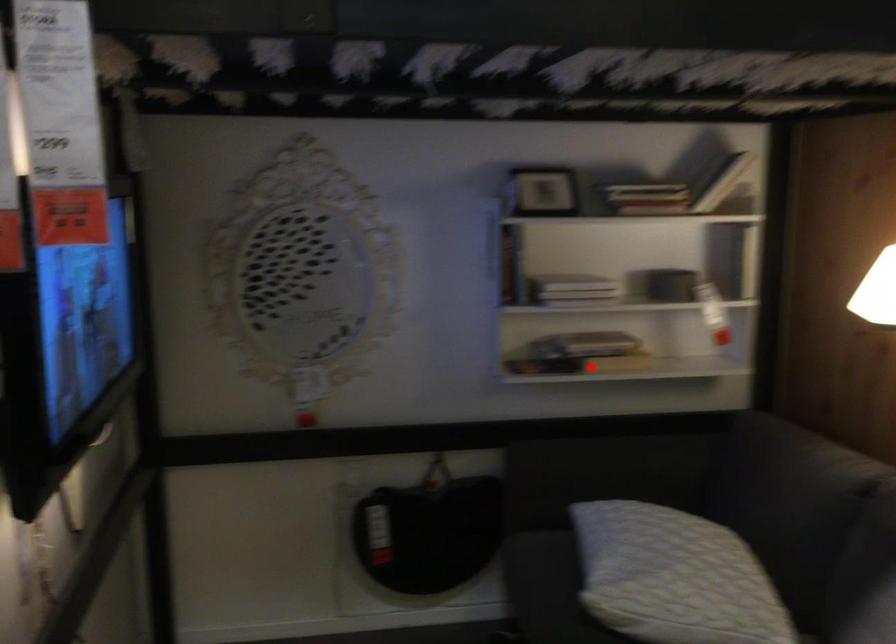
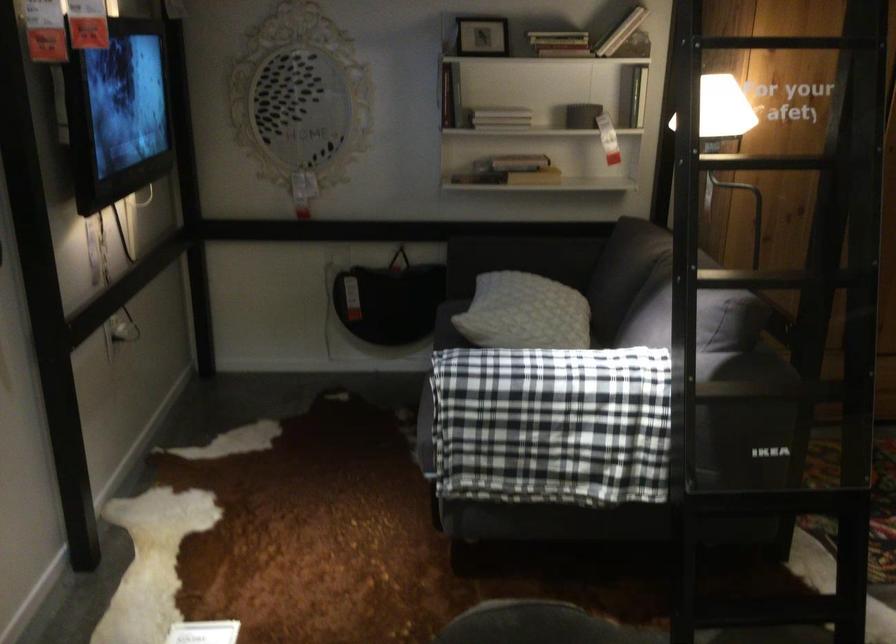
Question: A red point is marked in image1. In image2, is the corresponding 3D point closer to the camera or farther? Reply with the corresponding letter.

Choices:
 (A) The corresponding 3D point is closer.
 (B) The corresponding 3D point is farther.

Answer: (B)